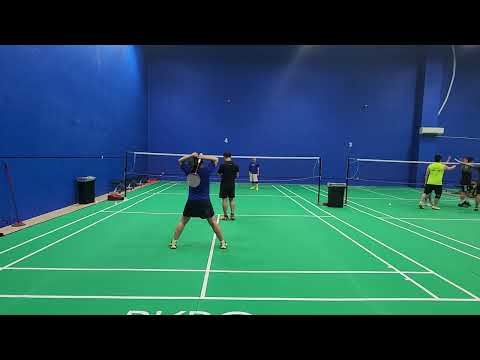
Image resolution: width=480 pixels, height=360 pixels. In order to click on trash cans in this screenshot , I will do point(87,186), point(329,189).